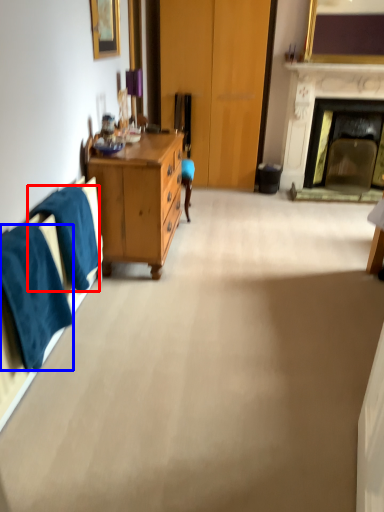
Question: Which object is closer to the camera taking this photo, towel/napkin (highlighted by a red box) or towel/napkin (highlighted by a blue box)?

Choices:
 (A) towel/napkin
 (B) towel/napkin

Answer: (B)